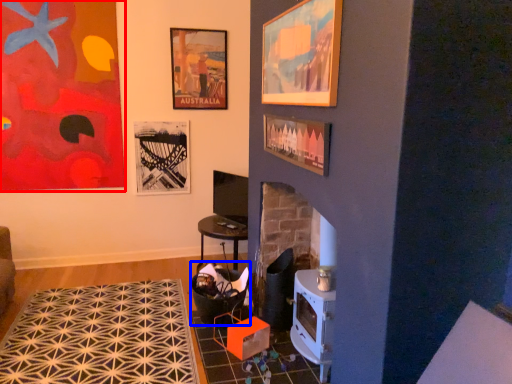
Question: Which object is further to the camera taking this photo, picture frame (highlighted by a red box) or rocking chair (highlighted by a blue box)?

Choices:
 (A) picture frame
 (B) rocking chair

Answer: (A)